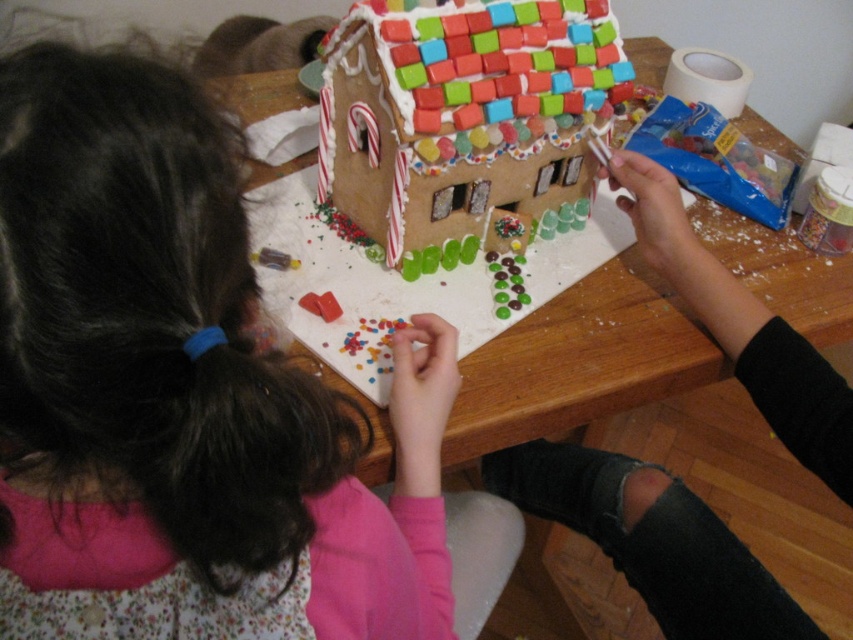
Question: Which object is farther from the camera taking this photo?

Choices:
 (A) matte pink shirt at center
 (B) wooden table at center

Answer: (B)

Question: Which point is closer to the camera?

Choices:
 (A) wooden table at center
 (B) matte pink shirt at center

Answer: (B)

Question: Is matte pink shirt at center further to camera compared to wooden table at center?

Choices:
 (A) yes
 (B) no

Answer: (B)

Question: Does matte pink shirt at center appear under wooden table at center?

Choices:
 (A) yes
 (B) no

Answer: (A)

Question: Can you confirm if matte pink shirt at center is smaller than wooden table at center?

Choices:
 (A) no
 (B) yes

Answer: (B)